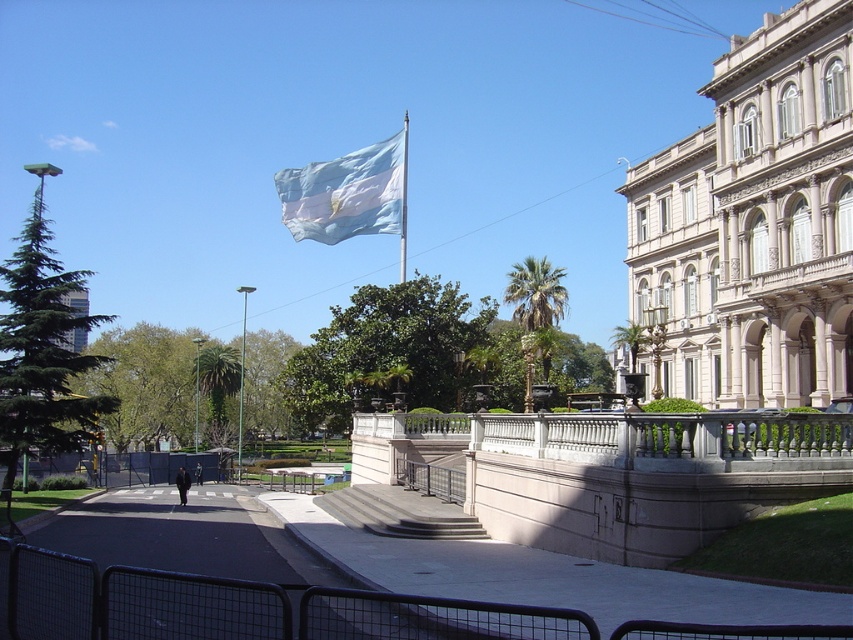
Does point (312, 179) come behind point (403, 177)?

Yes, point (312, 179) is behind point (403, 177).

Does blue fabric flag at upper center come behind white fabric flag at upper center?

Yes, blue fabric flag at upper center is further from the viewer.

Find the location of a particular element. The image size is (853, 640). blue fabric flag at upper center is located at coordinates (347, 193).